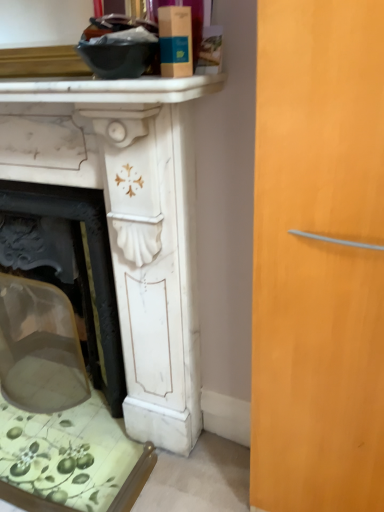
Question: Choose the correct answer: Is white marble fireplace at left inside white marble fireplace mantel at upper center or outside it?

Choices:
 (A) outside
 (B) inside

Answer: (A)

Question: From a real-world perspective, is white marble fireplace at left above or below white marble fireplace mantel at upper center?

Choices:
 (A) above
 (B) below

Answer: (B)

Question: In terms of width, does white marble fireplace at left look wider or thinner when compared to white marble fireplace mantel at upper center?

Choices:
 (A) thin
 (B) wide

Answer: (B)

Question: Considering the positions of white marble fireplace mantel at upper center and white marble fireplace at left in the image, is white marble fireplace mantel at upper center taller or shorter than white marble fireplace at left?

Choices:
 (A) tall
 (B) short

Answer: (B)

Question: Relative to white marble fireplace at left, is white marble fireplace mantel at upper center in front or behind?

Choices:
 (A) behind
 (B) front

Answer: (B)

Question: From a real-world perspective, is white marble fireplace mantel at upper center positioned above or below white marble fireplace at left?

Choices:
 (A) below
 (B) above

Answer: (B)

Question: Is white marble fireplace mantel at upper center inside or outside of white marble fireplace at left?

Choices:
 (A) outside
 (B) inside

Answer: (A)